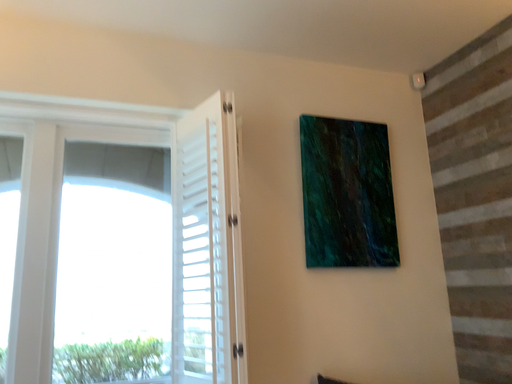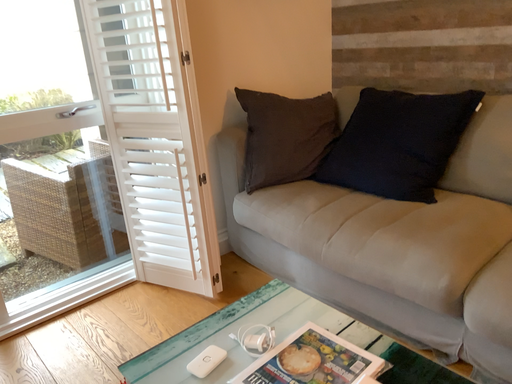
Question: How did the camera likely rotate when shooting the video?

Choices:
 (A) rotated upward
 (B) rotated downward

Answer: (B)